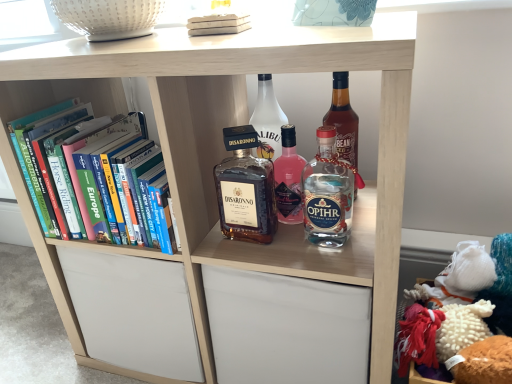
Question: From the image's perspective, is clear glass bottle at center, which is the 1th bottle in right-to-left order, located above hardcover books at left, positioned as the first book in left-to-right order?

Choices:
 (A) no
 (B) yes

Answer: (A)

Question: Are clear glass bottle at center, which is the 1th bottle in right-to-left order, and hardcover books at left, positioned as the first book in left-to-right order, far apart?

Choices:
 (A) no
 (B) yes

Answer: (A)

Question: Is clear glass bottle at center, the third bottle when ordered from left to right, facing away from hardcover books at left, the second book viewed from the top?

Choices:
 (A) no
 (B) yes

Answer: (A)

Question: Does clear glass bottle at center, which is the 1th bottle in right-to-left order, have a greater height compared to hardcover books at left, the 1th book in the back-to-front sequence?

Choices:
 (A) yes
 (B) no

Answer: (B)

Question: From a real-world perspective, is clear glass bottle at center, which is the 1th bottle in right-to-left order, physically above hardcover books at left, the second book positioned from the front?

Choices:
 (A) yes
 (B) no

Answer: (B)

Question: In the image, is clear glass bottle at center, which is the 1th bottle in right-to-left order, positioned in front of or behind matte glass bottle at center, arranged as the first bottle when viewed from the left?

Choices:
 (A) behind
 (B) front

Answer: (B)

Question: Visually, is clear glass bottle at center, which is the 1th bottle in right-to-left order, positioned to the left or to the right of matte glass bottle at center, which is the third bottle in right-to-left order?

Choices:
 (A) right
 (B) left

Answer: (A)

Question: From a real-world perspective, is clear glass bottle at center, which is the 1th bottle in right-to-left order, above or below matte glass bottle at center, arranged as the first bottle when viewed from the left?

Choices:
 (A) below
 (B) above

Answer: (A)

Question: Is clear glass bottle at center, the third bottle when ordered from left to right, bigger or smaller than matte glass bottle at center, which is the third bottle in right-to-left order?

Choices:
 (A) big
 (B) small

Answer: (B)

Question: Is point (314, 225) closer or farther from the camera than point (98, 134)?

Choices:
 (A) farther
 (B) closer

Answer: (B)

Question: Considering the relative positions of clear glass bottle at center, which is the 1th bottle in right-to-left order, and hardcover books at left, positioned as the first book in left-to-right order, in the image provided, is clear glass bottle at center, which is the 1th bottle in right-to-left order, to the left or to the right of hardcover books at left, positioned as the first book in left-to-right order,?

Choices:
 (A) right
 (B) left

Answer: (A)

Question: In terms of width, does clear glass bottle at center, which is the 1th bottle in right-to-left order, look wider or thinner when compared to hardcover books at left, positioned as the first book in left-to-right order?

Choices:
 (A) thin
 (B) wide

Answer: (A)

Question: From a real-world perspective, relative to hardcover books at left, the second book from the right, is clear glass bottle at center, which is the 1th bottle in right-to-left order, vertically above or below?

Choices:
 (A) above
 (B) below

Answer: (B)

Question: From the image's perspective, is clear glass bottle at center, the third bottle when ordered from left to right, above or below white matte book at upper center, the second book positioned from the back?

Choices:
 (A) above
 (B) below

Answer: (B)

Question: Considering the positions of point (339, 220) and point (202, 18), is point (339, 220) closer or farther from the camera than point (202, 18)?

Choices:
 (A) closer
 (B) farther

Answer: (A)